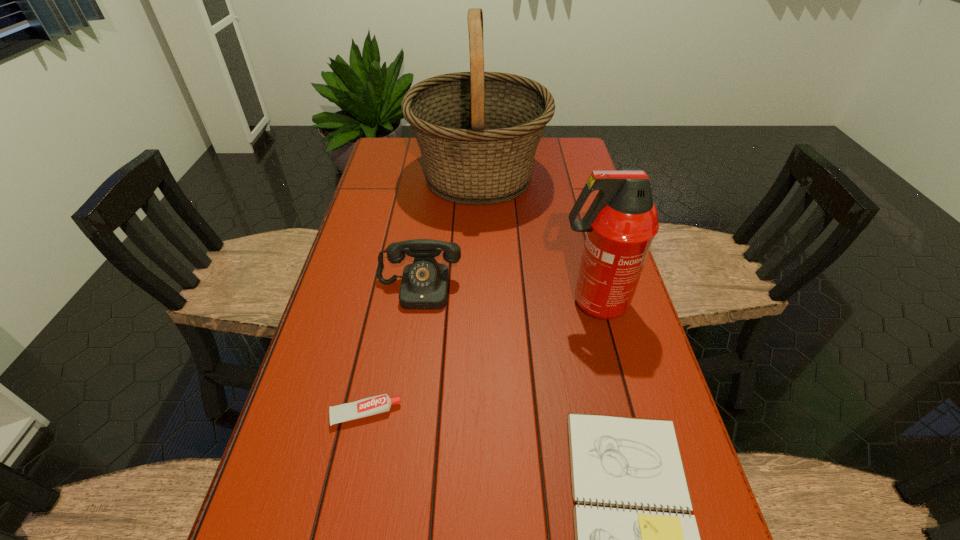
Where is `vacant space at the right edge`? The height and width of the screenshot is (540, 960). vacant space at the right edge is located at coordinates (587, 174).

In order to click on vacant space that's between the basket and the telephone in this screenshot , I will do `click(448, 233)`.

This screenshot has height=540, width=960. Find the location of `vacant space in between the second shortest object and the third shortest object`. vacant space in between the second shortest object and the third shortest object is located at coordinates (392, 352).

Locate an element on the screen. blank region between the toothpaste and the fire extinguisher is located at coordinates (479, 358).

Where is `free area in between the tallest object and the telephone`? The height and width of the screenshot is (540, 960). free area in between the tallest object and the telephone is located at coordinates (448, 233).

Locate an element on the screen. The width and height of the screenshot is (960, 540). unoccupied position between the fire extinguisher and the telephone is located at coordinates (506, 296).

Image resolution: width=960 pixels, height=540 pixels. I want to click on free space between the second tallest object and the basket, so click(536, 240).

At what (x,y) coordinates should I click in order to perform the action: click on object that is the third closest one to the farthest object. Please return your answer as a coordinate pair (x, y). The height and width of the screenshot is (540, 960). Looking at the image, I should click on (374, 405).

Identify which object is located as the fourth nearest to the fire extinguisher. Please provide its 2D coordinates. Your answer should be formatted as a tuple, i.e. [(x, y)], where the tuple contains the x and y coordinates of a point satisfying the conditions above.

[(374, 405)]